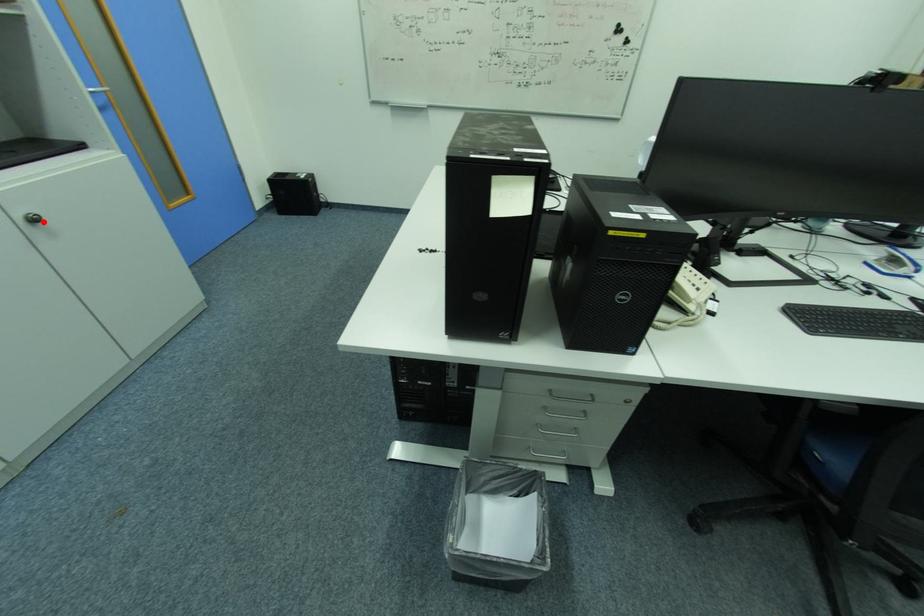
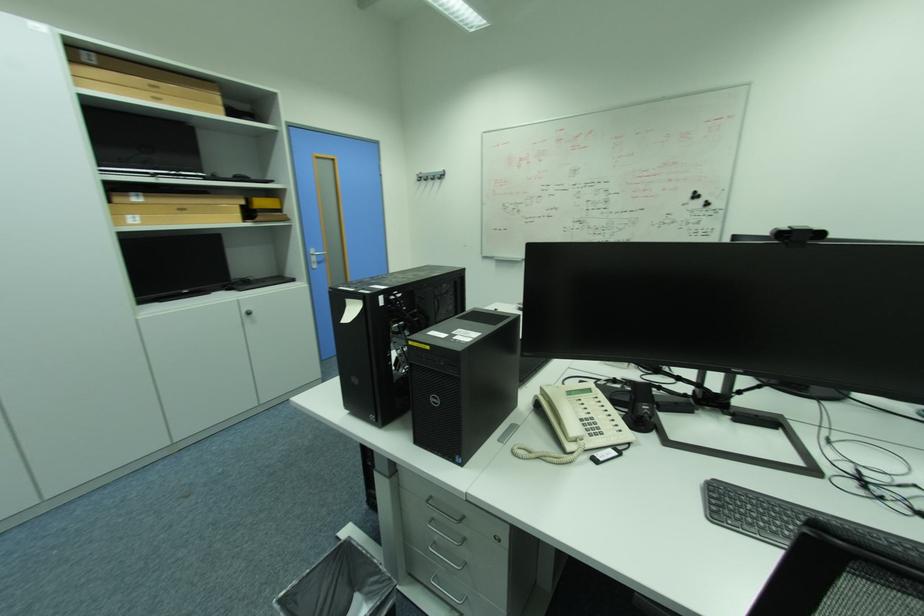
Locate, in the second image, the point that corresponds to the highlighted location in the first image.

(257, 314)